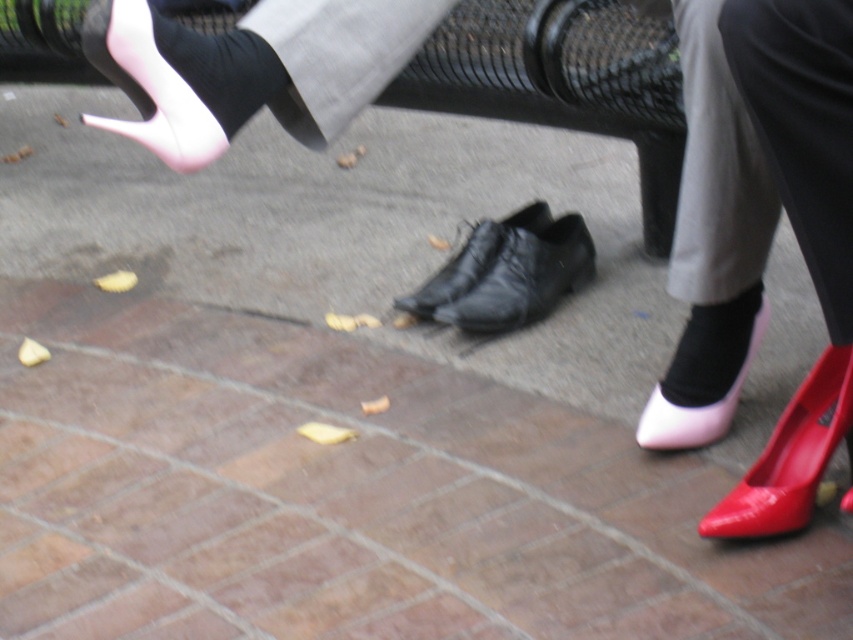
You are a photographer trying to capture both the glossy patent shoe at lower right and the black leather boot at center in a single frame. Given their positions and sizes, which shoe will appear larger in the photo?

The glossy patent shoe at lower right will appear larger in the photo because it is much taller than the black leather boot at center.

You are a photographer setting up a shoot on the paved outdoor area. You have two shoes to place in the frame for a closeup shot. The glossy patent shoe at lower right and the black leather boot at center are both in your shot. Since you want to emphasize the size difference between them, which shoe should you position closer to the camera to make it appear bigger?

To emphasize the size difference between the glossy patent shoe at lower right and the black leather boot at center, you should position the black leather boot at center closer to the camera. Since the glossy patent shoe at lower right is already larger in size, moving the smaller black leather boot at center closer can create a visual contrast where the closer object appears bigger despite its actual size.